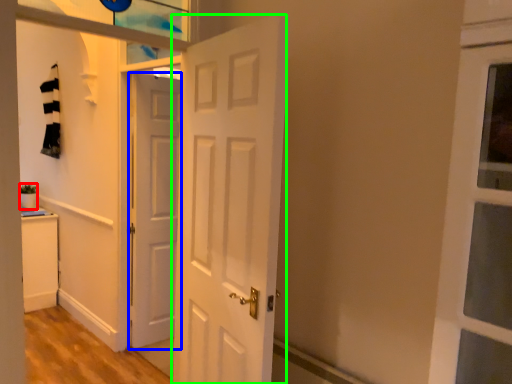
Question: Considering the real-world distances, which object is closest to houseplant (highlighted by a red box)? door (highlighted by a blue box) or door (highlighted by a green box).

Choices:
 (A) door
 (B) door

Answer: (A)